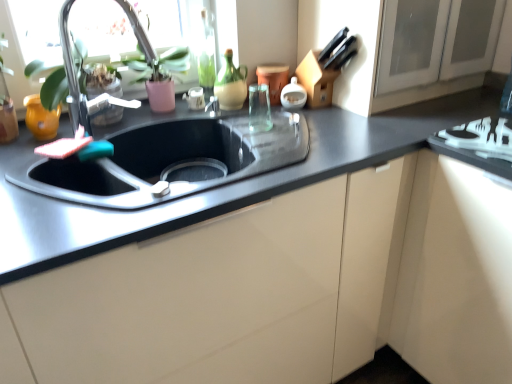
At what (x,y) coordinates should I click in order to perform the action: click on free space to the left of white glossy coffee cup at center, arranged as the 3th appliance when viewed from the right. Please return your answer as a coordinate pair (x, y). Looking at the image, I should click on (158, 117).